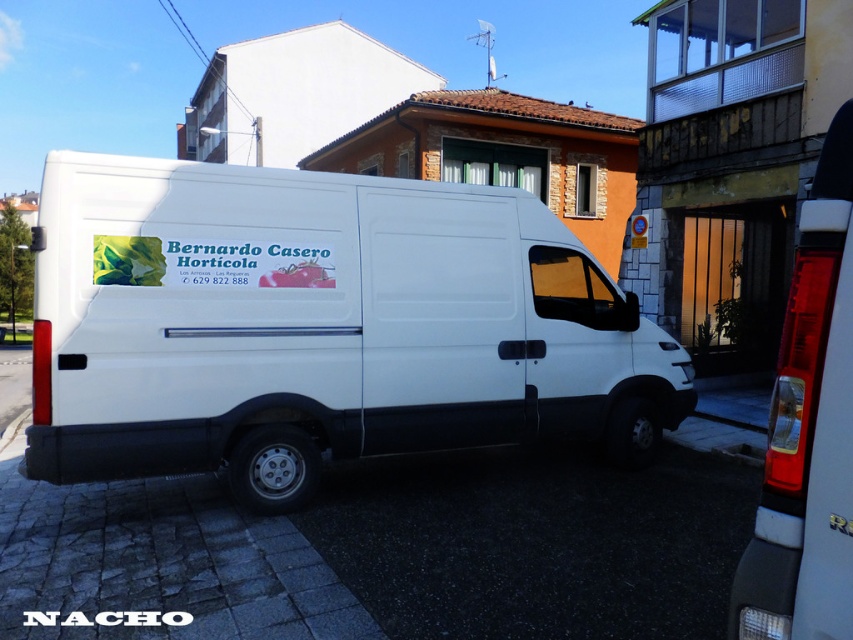
You are standing at the point with coordinates point [805,250] and want to walk to the point [152,212]. According to the scene, will you be moving towards the van or away from it?

Since point [152,212] is behind point [805,250], moving from point [805,250] to point [152,212] means you are moving towards the van.